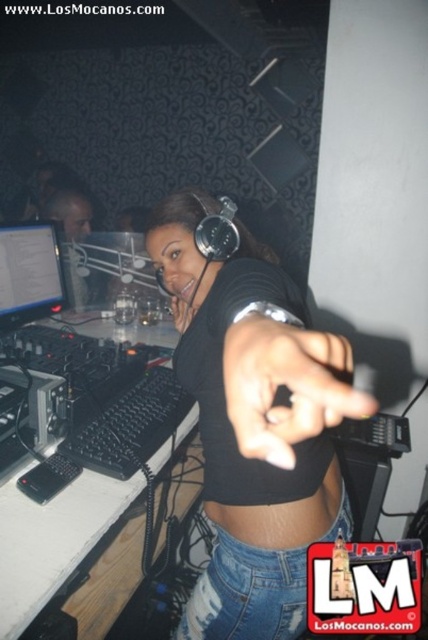
Between black matte hand at center and black matte skin at center, which one has more height?

With more height is black matte hand at center.

Can you confirm if black matte hand at center is shorter than black matte skin at center?

In fact, black matte hand at center may be taller than black matte skin at center.

Which is behind, point (341, 397) or point (267, 540)?

The point (267, 540) is behind.

This screenshot has width=428, height=640. Identify the location of black matte hand at center. (287, 387).

The image size is (428, 640). What do you see at coordinates (287, 387) in the screenshot? I see `black matte hand at center` at bounding box center [287, 387].

Does black matte hand at center have a lesser width compared to matte black monitor at left?

No, black matte hand at center is not thinner than matte black monitor at left.

Is point (252, 324) positioned after point (6, 252)?

No, (252, 324) is closer to viewer.

Where is `black matte hand at center`? The height and width of the screenshot is (640, 428). black matte hand at center is located at coordinates (287, 387).

Which is more to the left, black matte headphones at upper center or black matte hand at center?

Positioned to the left is black matte headphones at upper center.

Is black matte headphones at upper center further to camera compared to black matte hand at center?

Yes.

Image resolution: width=428 pixels, height=640 pixels. What do you see at coordinates (253, 426) in the screenshot?
I see `black matte headphones at upper center` at bounding box center [253, 426].

Locate an element on the screen. The image size is (428, 640). black matte headphones at upper center is located at coordinates (253, 426).